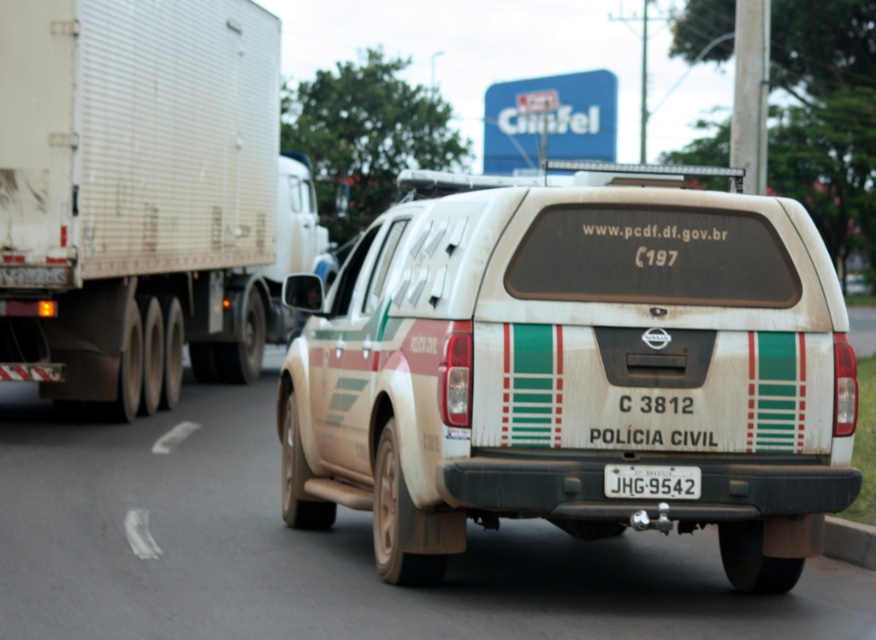
Question: Which object appears closest to the camera in this image?

Choices:
 (A) matte white truck at left
 (B) white corrugated metal trailer truck at left
 (C) matte beige pickup truck at center
 (D) white plastic license plate at center

Answer: (C)

Question: Does matte white truck at left appear under white plastic license plate at center?

Choices:
 (A) no
 (B) yes

Answer: (A)

Question: Which point is farther to the camera?

Choices:
 (A) (661, 352)
 (B) (189, 342)
 (C) (609, 465)
 (D) (46, 160)

Answer: (B)

Question: Among these objects, which one is nearest to the camera?

Choices:
 (A) matte beige pickup truck at center
 (B) white corrugated metal trailer truck at left
 (C) white plastic license plate at center

Answer: (A)

Question: Is matte white truck at left in front of white plastic license plate at center?

Choices:
 (A) no
 (B) yes

Answer: (A)

Question: Is matte beige pickup truck at center smaller than white corrugated metal trailer truck at left?

Choices:
 (A) yes
 (B) no

Answer: (A)